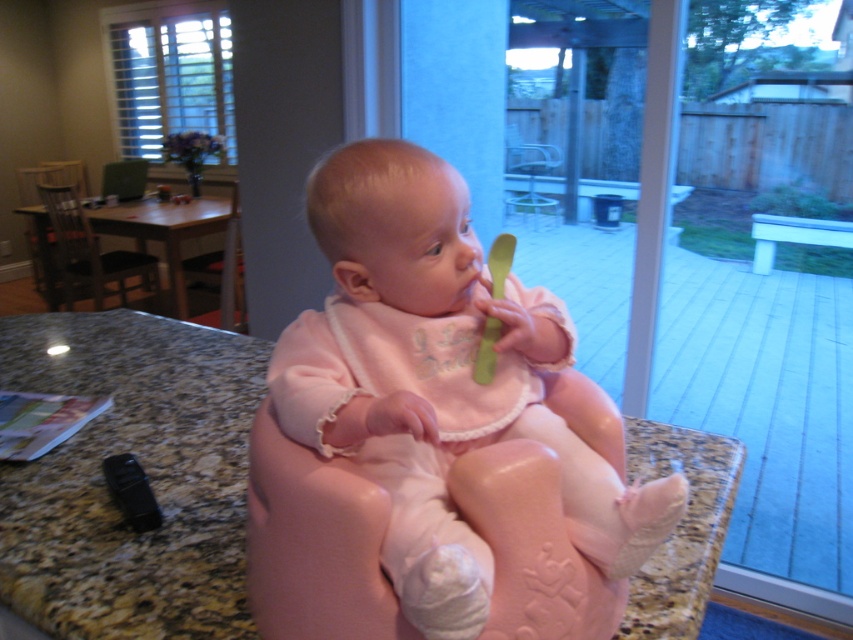
Between pink fabric baby at center and granite countertop at center, which one has less height?

granite countertop at center

Is pink fabric baby at center to the right of granite countertop at center from the viewer's perspective?

Indeed, pink fabric baby at center is positioned on the right side of granite countertop at center.

This screenshot has height=640, width=853. What are the coordinates of `pink fabric baby at center` in the screenshot? It's located at (438, 381).